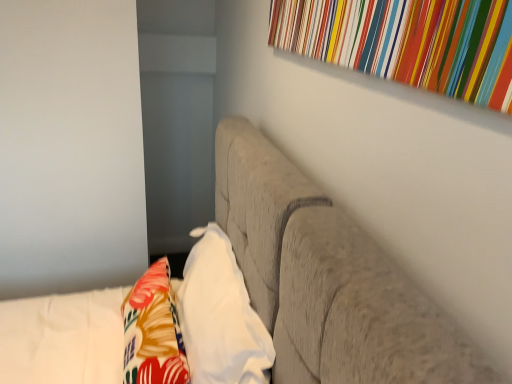
Question: Considering the positions of textured gray sofa at center and floral fabric throw pillow at lower left in the image, is textured gray sofa at center taller or shorter than floral fabric throw pillow at lower left?

Choices:
 (A) short
 (B) tall

Answer: (B)

Question: Based on their positions, is textured gray sofa at center located to the left or right of floral fabric throw pillow at lower left?

Choices:
 (A) left
 (B) right

Answer: (A)

Question: Estimate the real-world distances between objects in this image. Which object is farther from the white soft pillow at center?

Choices:
 (A) textured gray sofa at center
 (B) multicolored striped fabric at upper right
 (C) floral fabric throw pillow at lower left

Answer: (B)

Question: Based on their relative distances, which object is nearer to the textured gray sofa at center?

Choices:
 (A) multicolored striped fabric at upper right
 (B) white soft pillow at center
 (C) floral fabric throw pillow at lower left

Answer: (B)